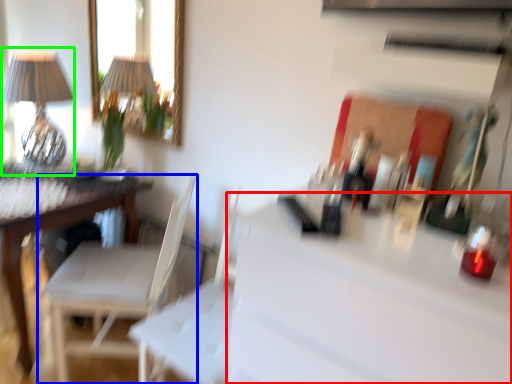
Question: Which object is positioned farthest from counter top (highlighted by a red box)? Select from chair (highlighted by a blue box) and table lamp (highlighted by a green box).

Choices:
 (A) chair
 (B) table lamp

Answer: (B)